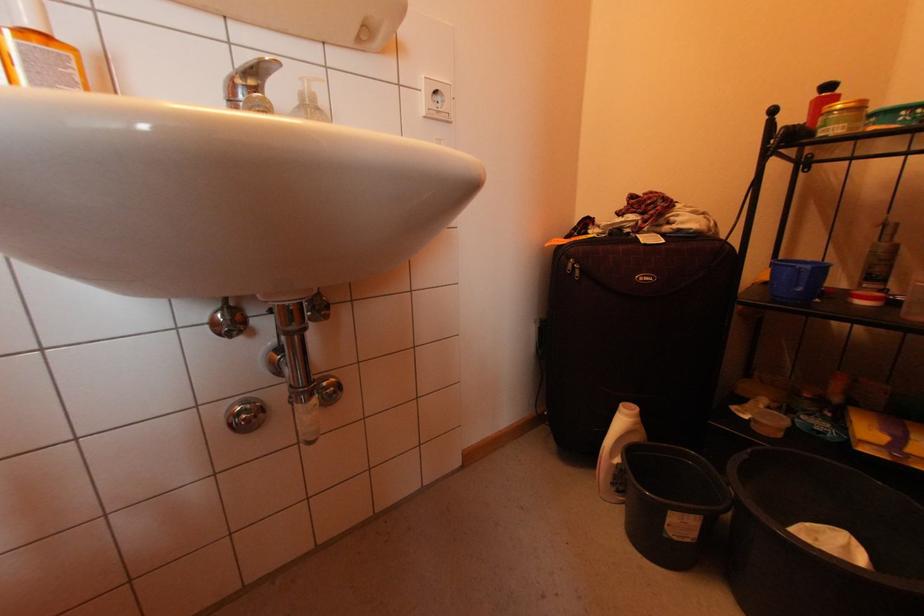
Where is `faucet lever`? The height and width of the screenshot is (616, 924). faucet lever is located at coordinates (258, 69).